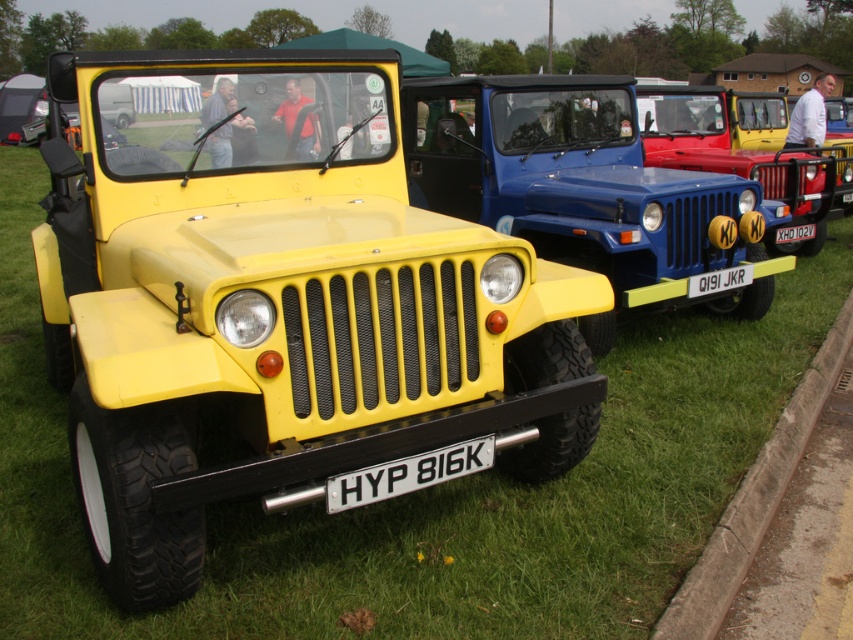
You are a photographer standing in front of the matte yellow jeep at center and the black plastic license plate at center. You want to take a photo that captures both objects in the frame. Which object should you focus on first to ensure both are in focus?

The matte yellow jeep at center is above the black plastic license plate at center, so you should focus on the matte yellow jeep at center first to ensure both are in focus.

You are a parking attendant who needs to ensure that all license plates on the Jeeps are visible. Given that the white plastic license plate at center and the black plastic license plate at center are both present in the scene, which license plate is narrower?

The white plastic license plate at center is narrower than the black plastic license plate at center since it has a lesser width.